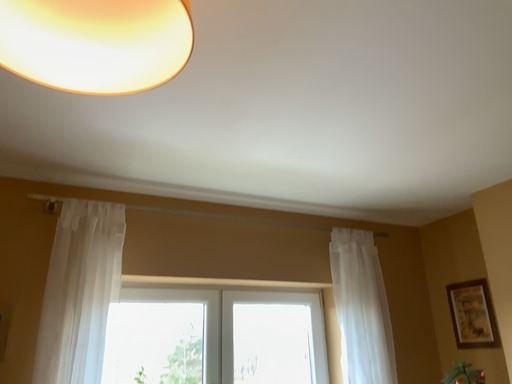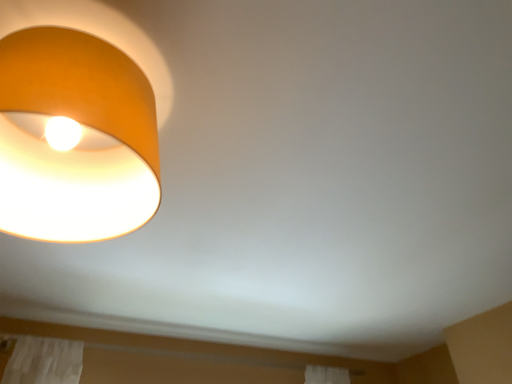
Question: How did the camera likely rotate when shooting the video?

Choices:
 (A) rotated downward
 (B) rotated upward

Answer: (B)